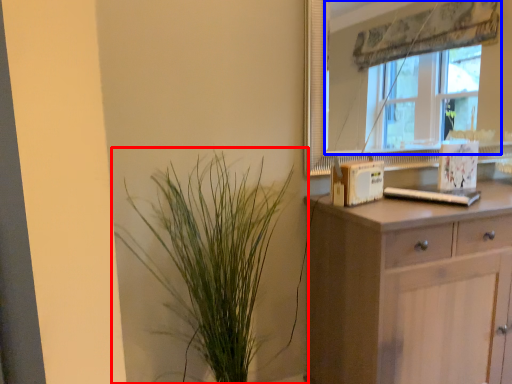
Question: Among these objects, which one is nearest to the camera, houseplant (highlighted by a red box) or window (highlighted by a blue box)?

Choices:
 (A) houseplant
 (B) window

Answer: (A)